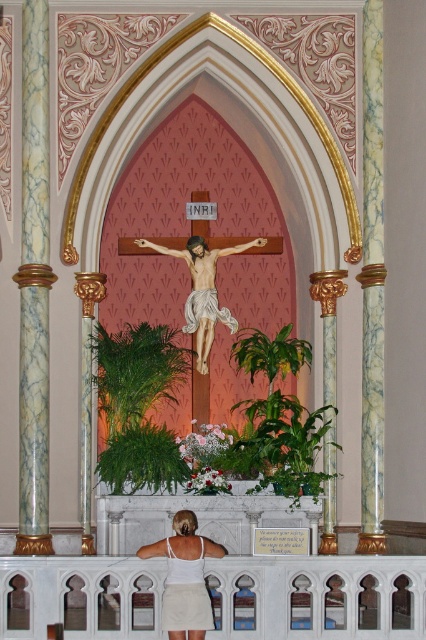
Can you confirm if white fabric at lower center is taller than wooden crucifix at center?

No.

Identify the location of white fabric at lower center. The height and width of the screenshot is (640, 426). (184, 577).

Describe the element at coordinates (184, 577) in the screenshot. I see `white fabric at lower center` at that location.

Locate an element on the screen. The image size is (426, 640). white fabric at lower center is located at coordinates (184, 577).

Who is positioned more to the left, marble column at left or wooden crucifix at center?

marble column at left

You are a GUI agent. You are given a task and a screenshot of the screen. Output one action in this format:
    pyautogui.click(x=<x>, y=<y>)
    Task: Click on the marble column at left
    
    Given the screenshot: What is the action you would take?
    pyautogui.click(x=34, y=285)

Locate an element on the screen. The height and width of the screenshot is (640, 426). marble column at left is located at coordinates (34, 285).

Is point (34, 429) positioned before point (169, 589)?

That is False.

Is point (37, 266) in front of point (181, 612)?

No, (37, 266) is further to viewer.

You are a GUI agent. You are given a task and a screenshot of the screen. Output one action in this format:
    pyautogui.click(x=<x>, y=<y>)
    Task: Click on the marble column at left
    
    Given the screenshot: What is the action you would take?
    pyautogui.click(x=34, y=285)